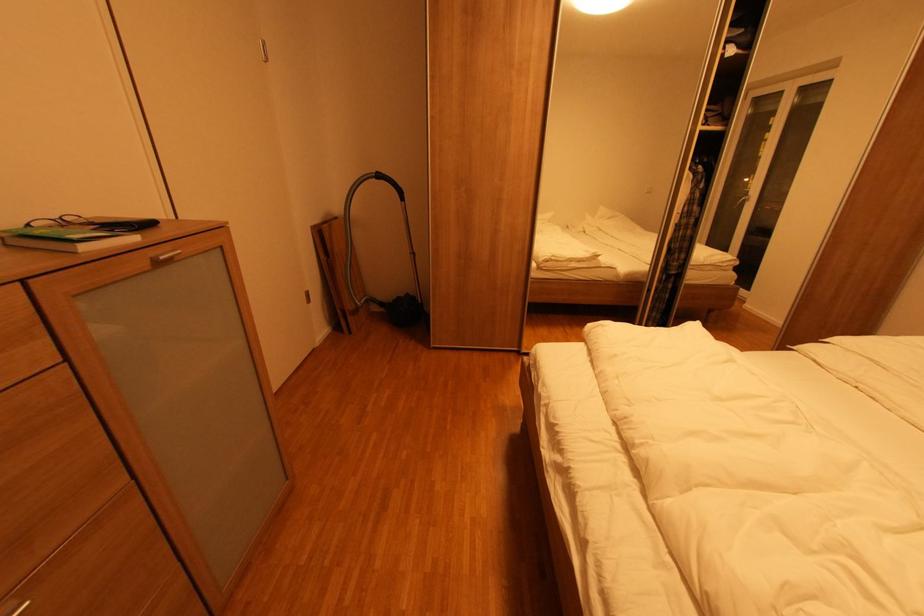
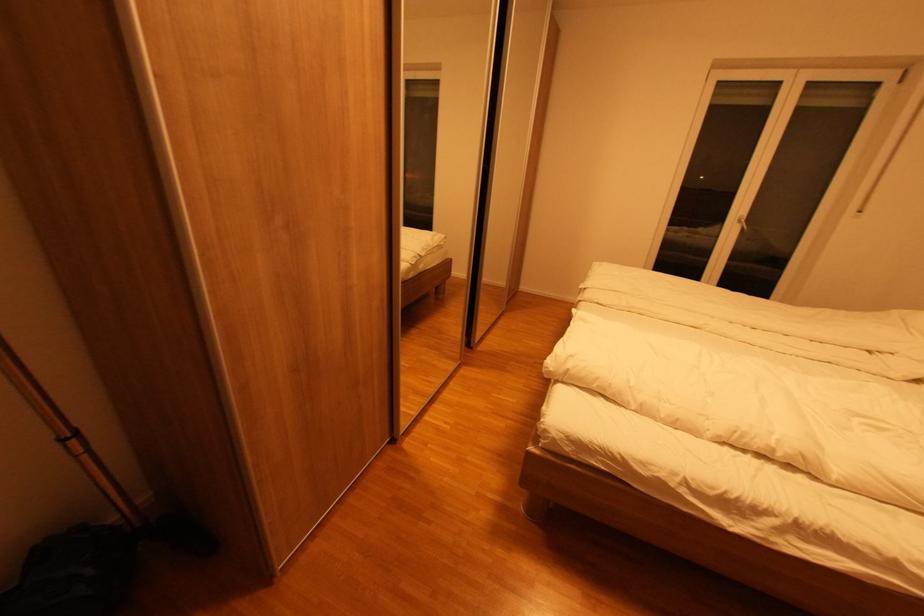
Locate, in the second image, the point that corresponds to [419,254] in the first image.

(83, 434)